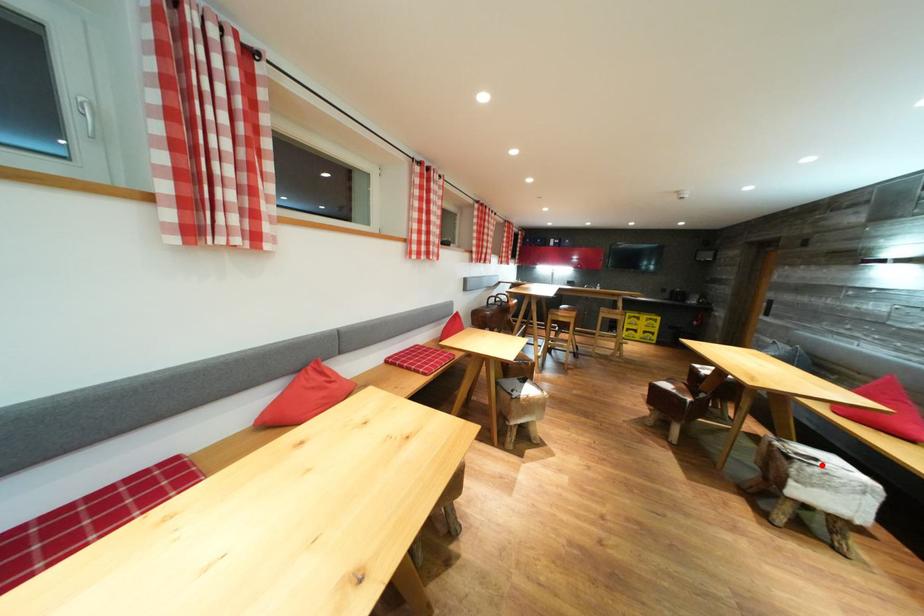
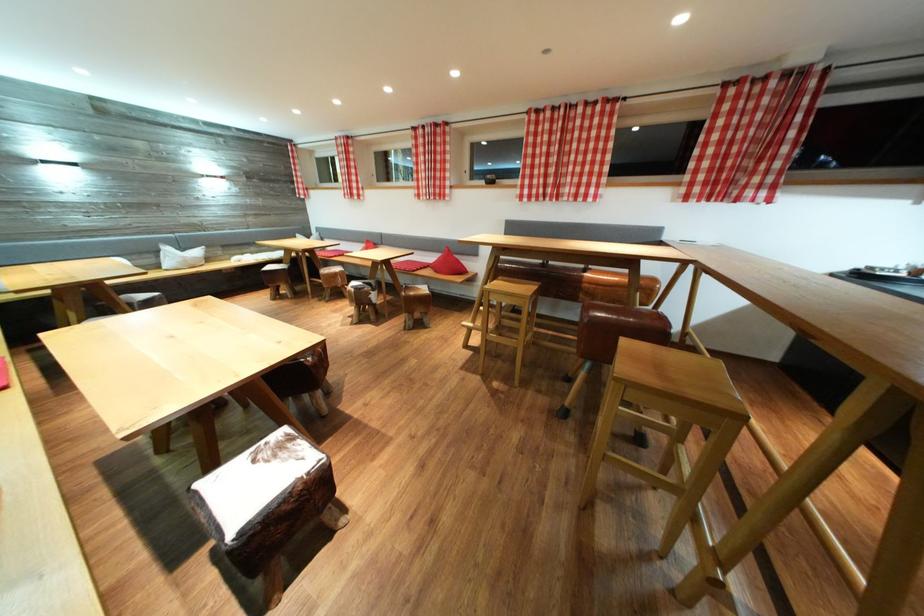
Question: I am providing you with two images of the same scene from different viewpoints. A red point is marked on the first image. Can you still see the location of the red point in image 2?

Choices:
 (A) Yes
 (B) No

Answer: (B)